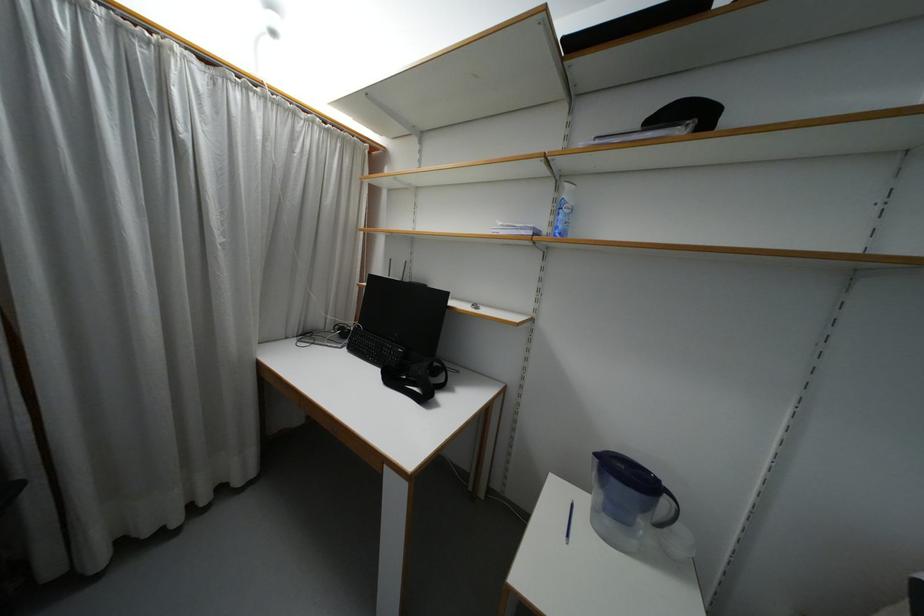
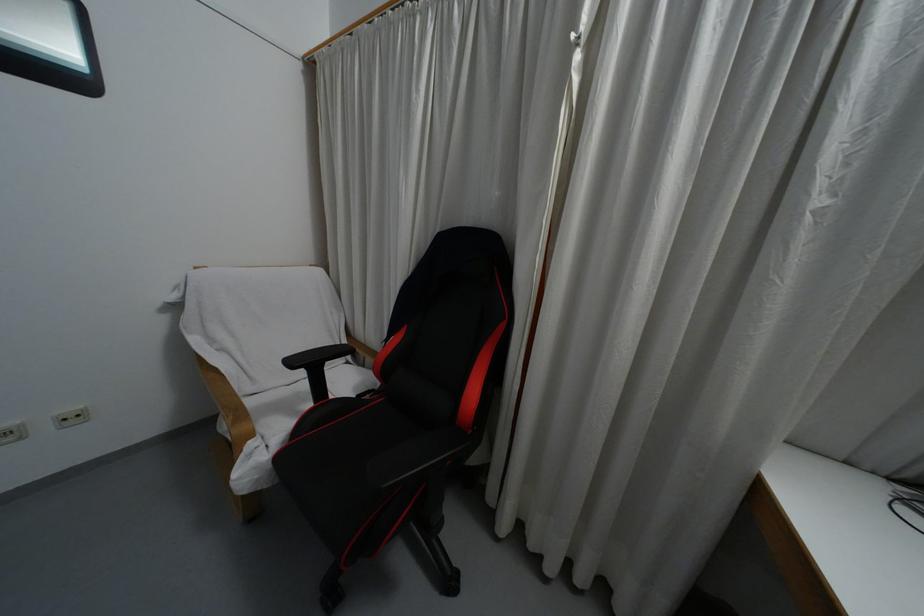
Question: The camera is either moving clockwise (left) or counter-clockwise (right) around the object. The first image is from the beginning of the video and the second image is from the end. Is the camera moving left or right when shooting the video?

Choices:
 (A) Left
 (B) Right

Answer: (B)